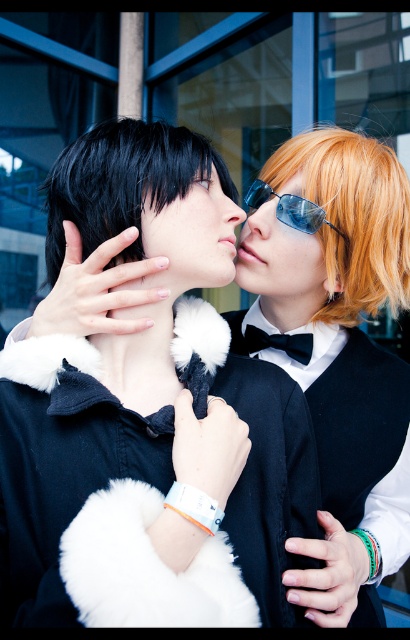
You are standing in front of a large glass window in a modern building. You see the matte black fur collar at center. Can you reach it with your hand if you extend it fully?

Result: The matte black fur collar at center is 26.46 inches away from the viewer. Since the average human arm length is about 25 inches, you might not be able to reach it with your fully extended hand.

You are a photographer trying to capture a closeup of both the shiny orange hair at upper right and the black matte hair at upper center. Based on their positions, which one is closer to the bottom of the frame?

The shiny orange hair at upper right is located below the black matte hair at upper center, so it is closer to the bottom of the frame.

You are standing at the point with coordinates point (x=218, y=161) and want to move to the exit located at point (x=104, y=184). Is there a clear path between these two points without any obstacles?

Point (x=104, y=184) is in front of point (x=218, y=161), so yes, there is a clear path between these two points without any obstacles.